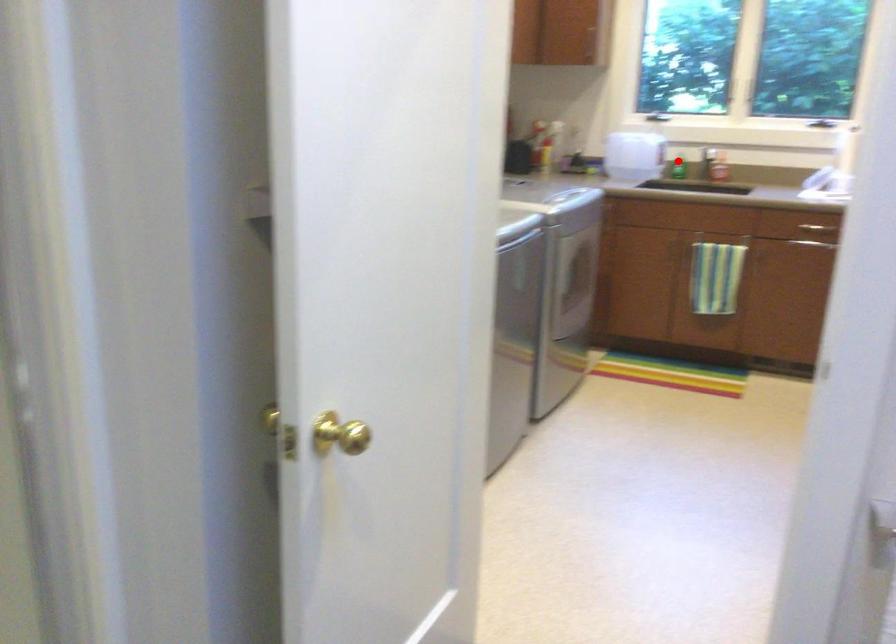
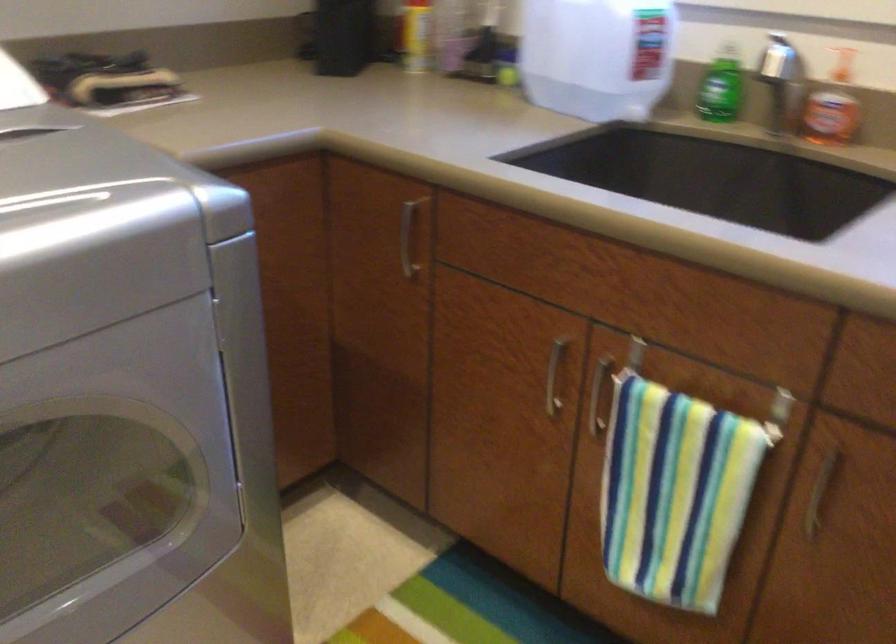
Question: I am providing you with two images of the same scene from different viewpoints. Given a red point in image1, look at the same physical point in image2. Is it:

Choices:
 (A) Closer to the viewpoint
 (B) Farther from the viewpoint

Answer: (A)